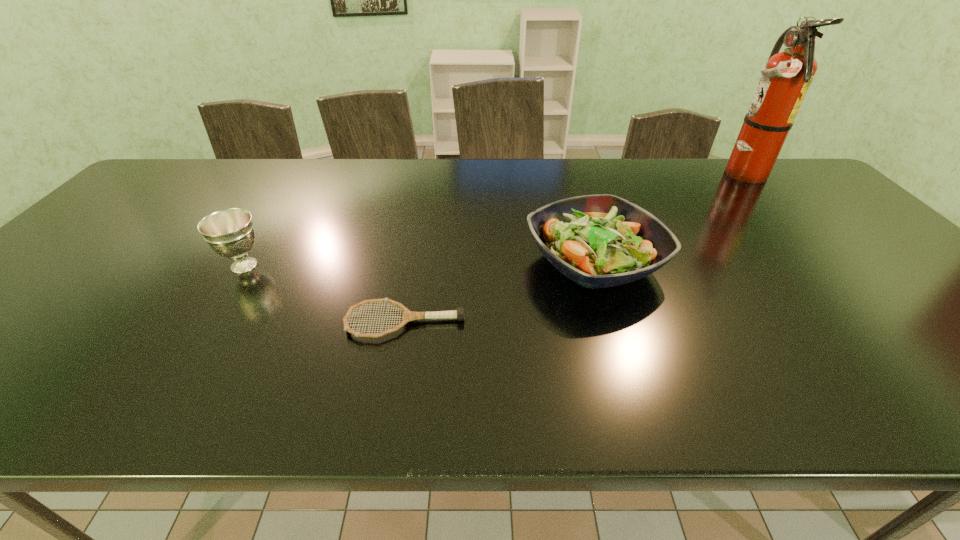
Where is `the farthest object`? This screenshot has height=540, width=960. the farthest object is located at coordinates (785, 80).

Where is `the rightmost object`? the rightmost object is located at coordinates (785, 80).

The height and width of the screenshot is (540, 960). I want to click on chalice, so click(x=230, y=232).

Identify the location of the second object from right to left. Image resolution: width=960 pixels, height=540 pixels. (601, 240).

In order to click on tennis racket in this screenshot , I will do `click(459, 314)`.

The width and height of the screenshot is (960, 540). I want to click on the shortest object, so click(x=459, y=314).

Locate an element on the screen. This screenshot has height=540, width=960. blank area located from the nozzle of the rightmost object is located at coordinates (636, 174).

Identify the location of vacant area located from the nozzle of the rightmost object. (x=666, y=174).

Locate an element on the screen. Image resolution: width=960 pixels, height=540 pixels. vacant region located from the nozzle of the rightmost object is located at coordinates (672, 174).

This screenshot has height=540, width=960. In order to click on vacant space located 0.090m on the front of the chalice in this screenshot , I will do `click(218, 307)`.